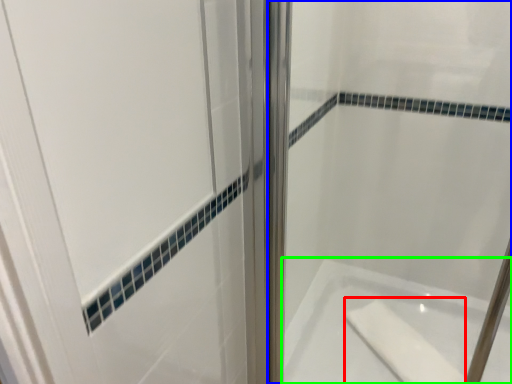
Question: Considering the real-world distances, which object is closest to soap (highlighted by a red box)? shower door (highlighted by a blue box) or bathtub (highlighted by a green box).

Choices:
 (A) shower door
 (B) bathtub

Answer: (B)